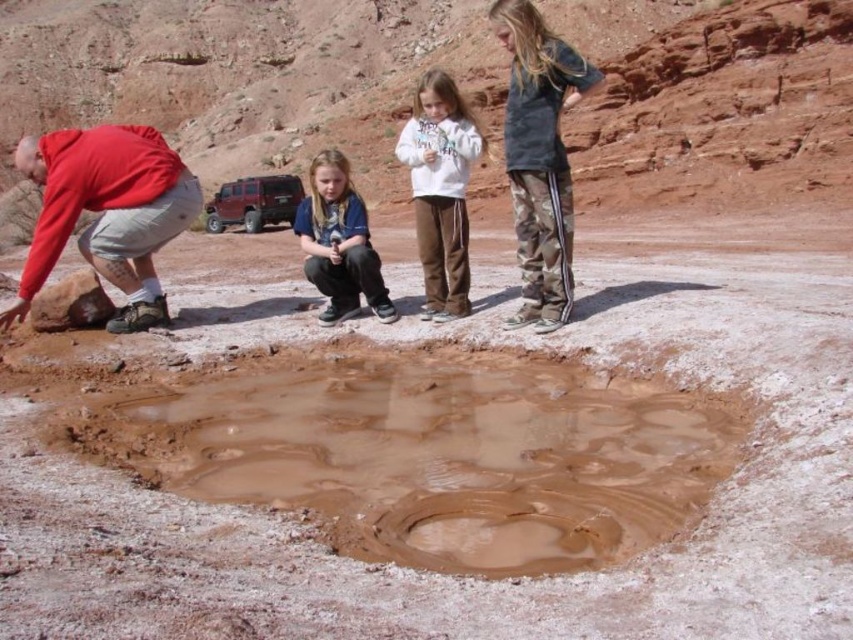
Question: From the image, what is the correct spatial relationship of red matte shirt at lower left in relation to camo pants at right?

Choices:
 (A) left
 (B) right

Answer: (A)

Question: Which point is closer to the camera?

Choices:
 (A) muddy wet puddle at center
 (B) white fleece jacket at center

Answer: (A)

Question: Which of the following is the farthest from the observer?

Choices:
 (A) muddy wet puddle at center
 (B) white fleece jacket at center
 (C) red matte shirt at lower left

Answer: (B)

Question: Is red matte shirt at lower left above blue denim jacket at center?

Choices:
 (A) yes
 (B) no

Answer: (A)

Question: Which point appears closest to the camera in this image?

Choices:
 (A) (518, 323)
 (B) (695, 403)
 (C) (76, 205)
 (D) (355, 241)

Answer: (B)

Question: Where is white fleece jacket at center located in relation to blue denim jacket at center in the image?

Choices:
 (A) above
 (B) below

Answer: (A)